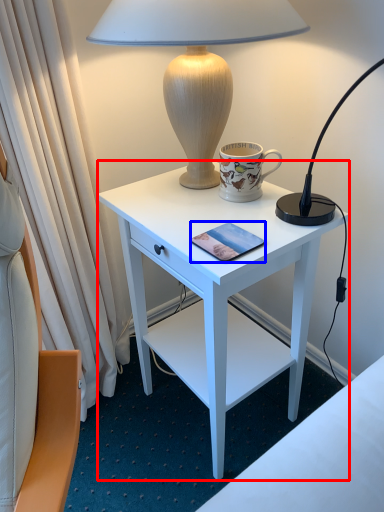
Question: Which of the following is the farthest to the observer, desk (highlighted by a red box) or pad (highlighted by a blue box)?

Choices:
 (A) desk
 (B) pad

Answer: (B)